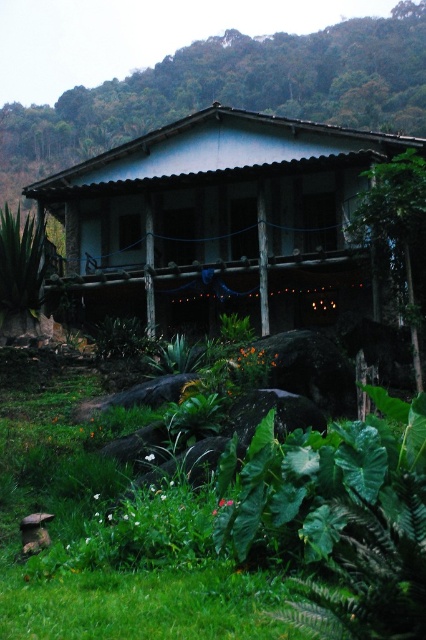
You are standing at the base of the house and want to place a 10 foot long wooden bench between the green leafy plant at lower center and the house. Is there enough space?

The distance between the green leafy plant at lower center and the house is 15.51 feet, so yes, there is enough space to place a 10 foot long wooden bench between them.

You are standing in front of the wooden hut at center and want to reach the green leafy plant at lower center. Which direction should you move to get there?

You should move to the right side of the wooden hut at center to reach the green leafy plant at lower center since it is positioned on the right side of the wooden hut at center.

You are standing in front of the rustic wooden house and want to place a decorative stone on the ground. The coordinates for placing the stone must be within the area where the green leafy plant at lower center is located. What are the coordinates for placing the stone?

The coordinates for placing the stone should be within the area of the green leafy plant at lower center, which is at point (181,540). So, you can place the stone near those coordinates.